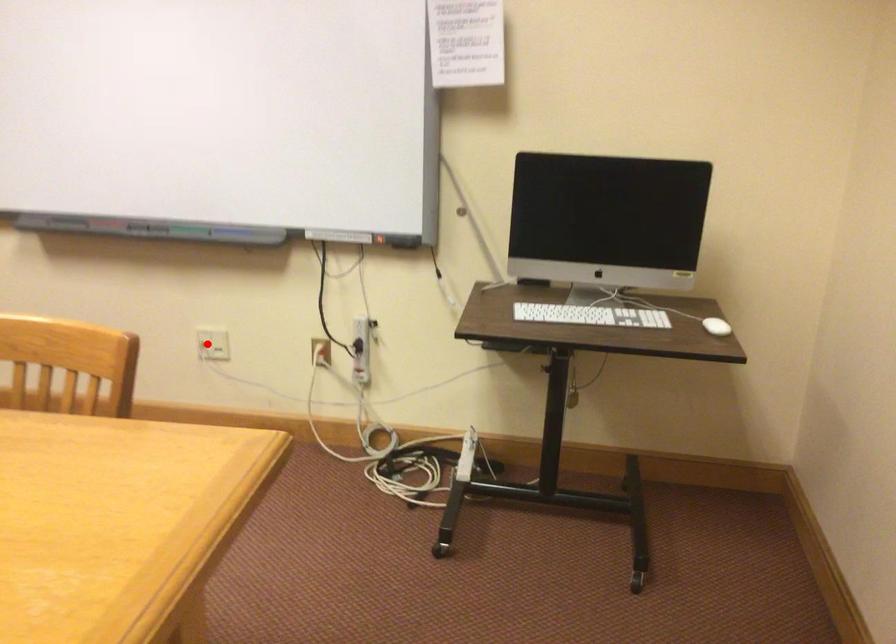
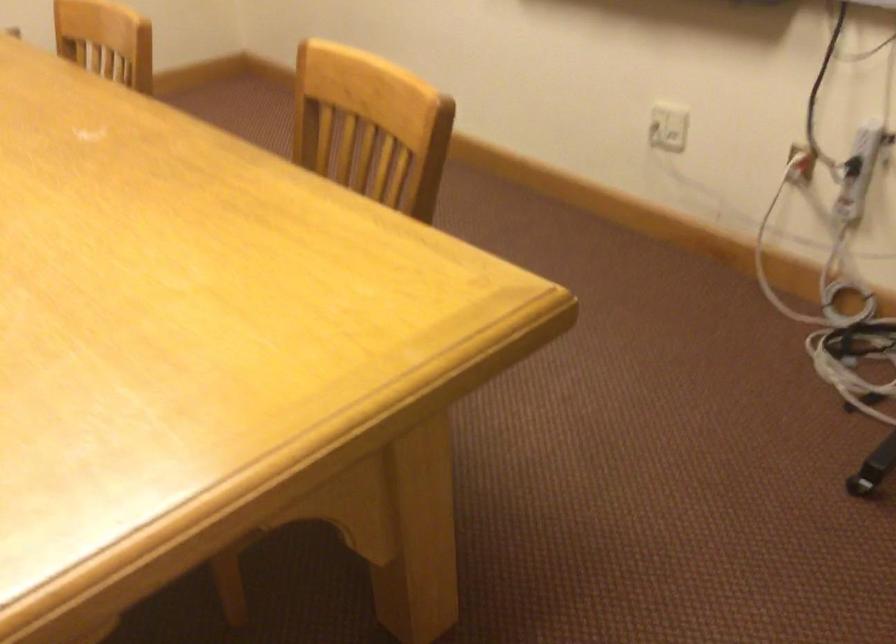
Question: I am providing you with two images of the same scene from different viewpoints. A red point is shown in image1. For the corresponding object point in image2, is it positioned nearer or farther from the camera?

Choices:
 (A) Nearer
 (B) Farther

Answer: (A)